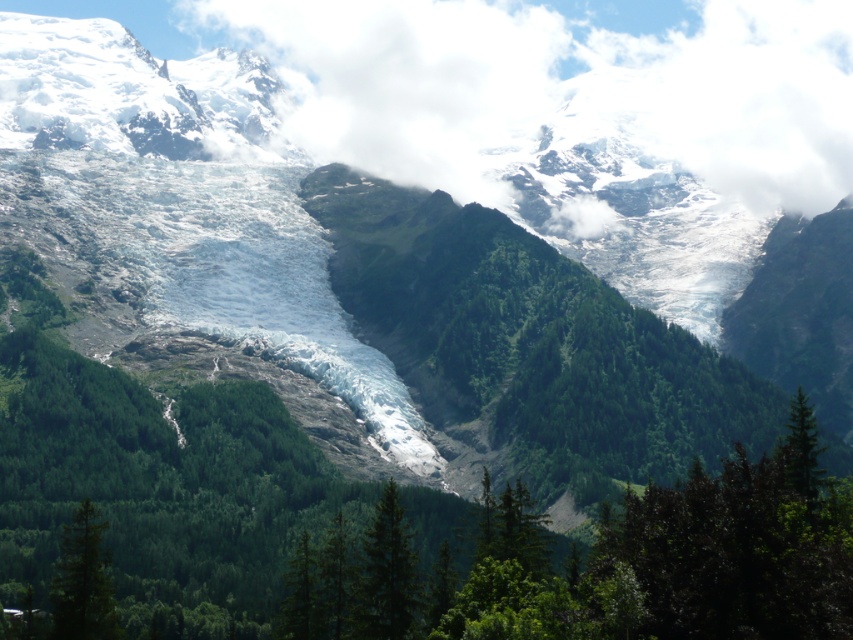
You are standing at the origin point in the image. Which direction should you move to reach the green matte tree at lower center?

The green matte tree at lower center is located at point (x=387, y=573), so you should move towards the lower center direction to reach it.

You are standing at the base of the mountain looking at the white fluffy cloud at upper center. If you have a telescope with a 1000 feet range, can you see the cloud clearly through it?

The white fluffy cloud at upper center is 1399.89 feet away from you. Since the telescope has a 1000 feet range, it cannot reach the cloud, so you cannot see it clearly through the telescope.